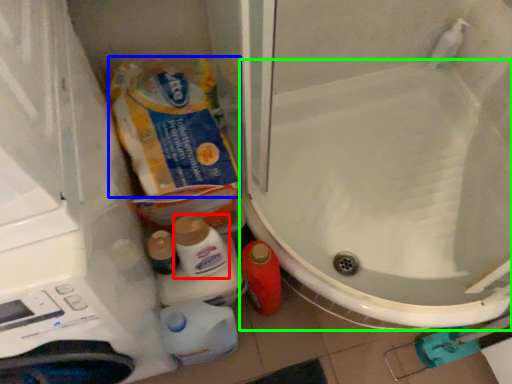
Question: Which object is the closest to the cleaning product (highlighted by a red box)? Choose among these: product (highlighted by a blue box) or toilet (highlighted by a green box).

Choices:
 (A) product
 (B) toilet

Answer: (A)